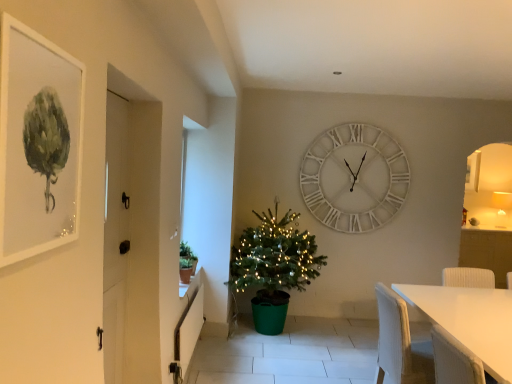
Question: From a real-world perspective, is white wooden clock at upper center physically located above or below white wooden door at left?

Choices:
 (A) below
 (B) above

Answer: (B)

Question: From the image's perspective, relative to white wooden door at left, is white wooden clock at upper center above or below?

Choices:
 (A) above
 (B) below

Answer: (A)

Question: Which is farther from the white matte table at lower right?

Choices:
 (A) matte white picture frame at upper left
 (B) green plastic christmas tree at center
 (C) green matte plant at left
 (D) white wooden clock at upper center
 (E) white wooden door at left

Answer: (D)

Question: Which object is positioned farthest from the white wooden door at left?

Choices:
 (A) white matte table at lower right
 (B) white wooden clock at upper center
 (C) matte white picture frame at upper left
 (D) green matte plant at left
 (E) green plastic christmas tree at center

Answer: (B)